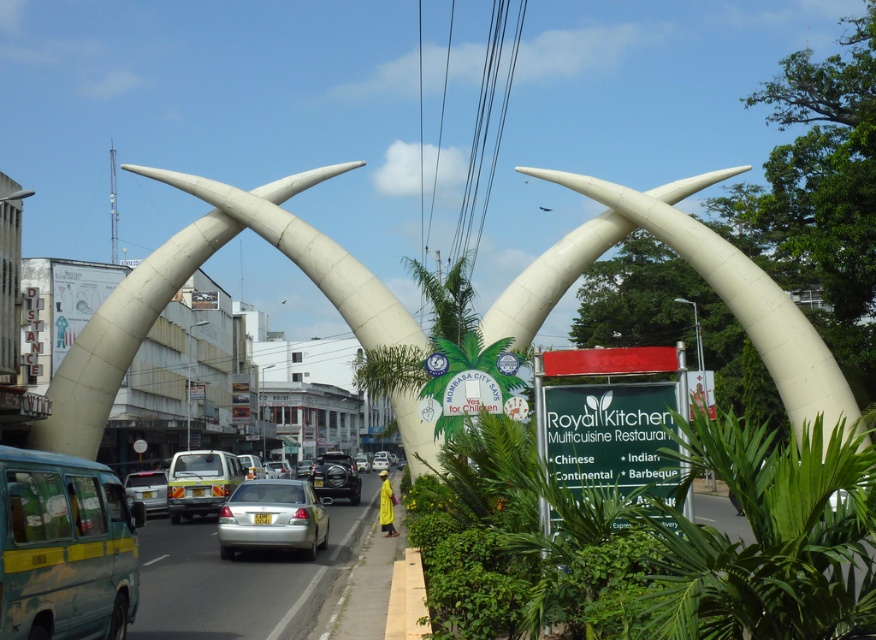
Looking at this image, you are a delivery driver needing to park your 5.5 meter long truck between the blue matte van at left and the satin silver sedan at center. Is there enough space?

The blue matte van at left is 8.66 meters away from the satin silver sedan at center. Since your truck is 5.5 meters long, there is sufficient space between them to park your truck.

You are standing at the base of the elephant tusk structure in the image. There are two points marked on the road ahead of you. The first point is at coordinates point (259, 508), and the second point is at coordinates point (184, 484). Which of these two points is closer to you?

Point (259, 508) is closer to the camera than point (184, 484), so the first point is closer to you.

You are a pedestrian standing at the intersection and see the blue matte van at left and the satin silver sedan at center. Which vehicle is closer to the elephant tusk structure in the foreground?

The blue matte van at left is positioned on the right side of satin silver sedan at center, so the satin silver sedan at center is closer to the elephant tusk structure in the foreground.